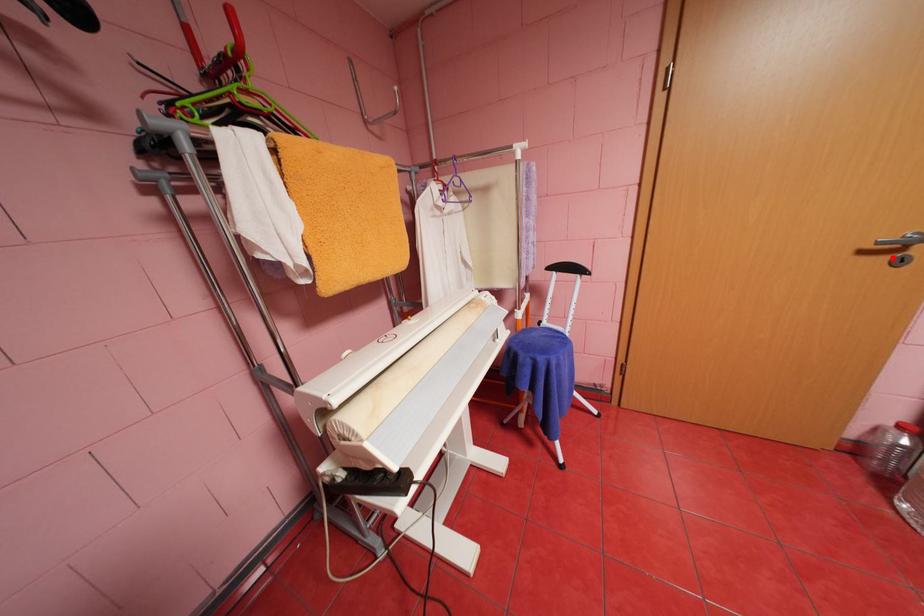
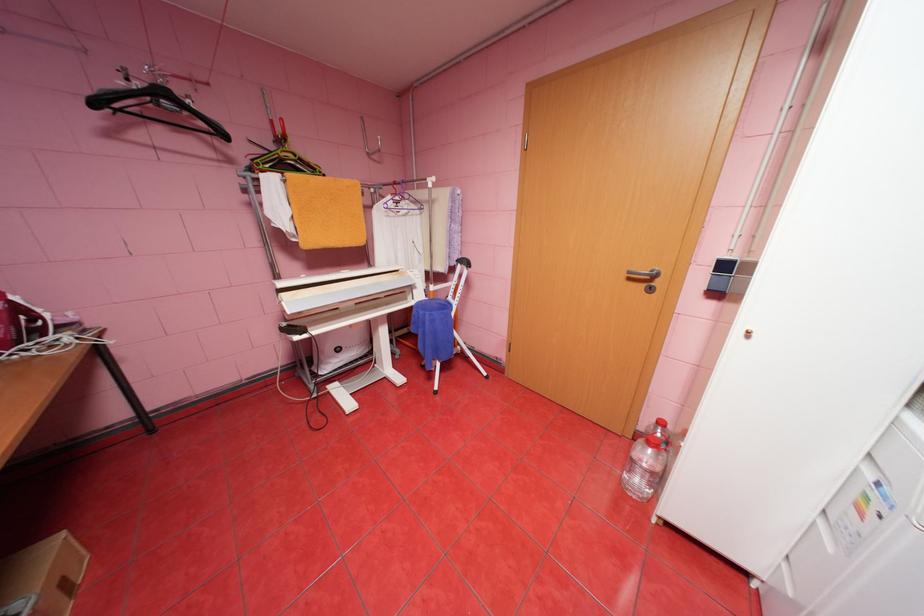
Question: I am providing you with two images of the same scene from different viewpoints. Image1 has a red point marked. In image2, the corresponding 3D location appears at what relative position? Reply with the corresponding letter.

Choices:
 (A) Closer
 (B) Farther

Answer: (A)